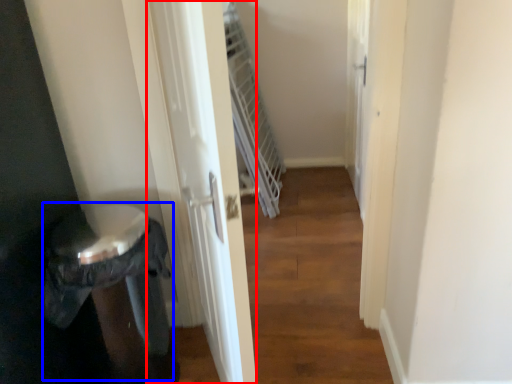
Question: Which object appears farthest to the camera in this image, screen door (highlighted by a red box) or potty (highlighted by a blue box)?

Choices:
 (A) screen door
 (B) potty

Answer: (B)